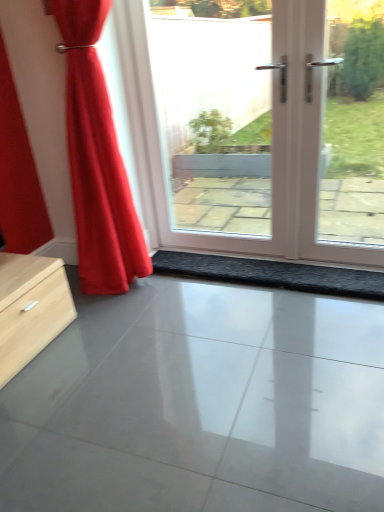
Where is `vacant space to the right of satin red curtain at left`? vacant space to the right of satin red curtain at left is located at coordinates (206, 293).